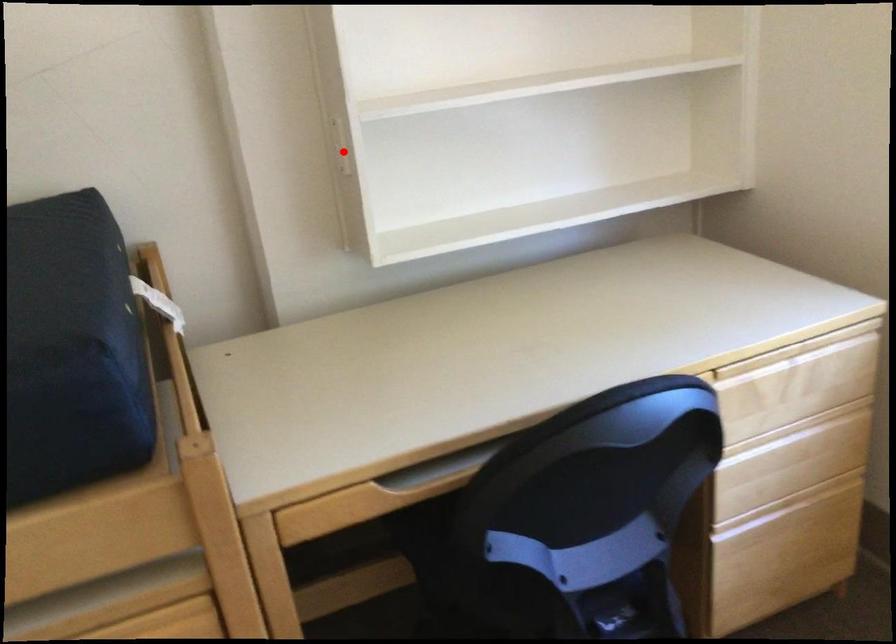
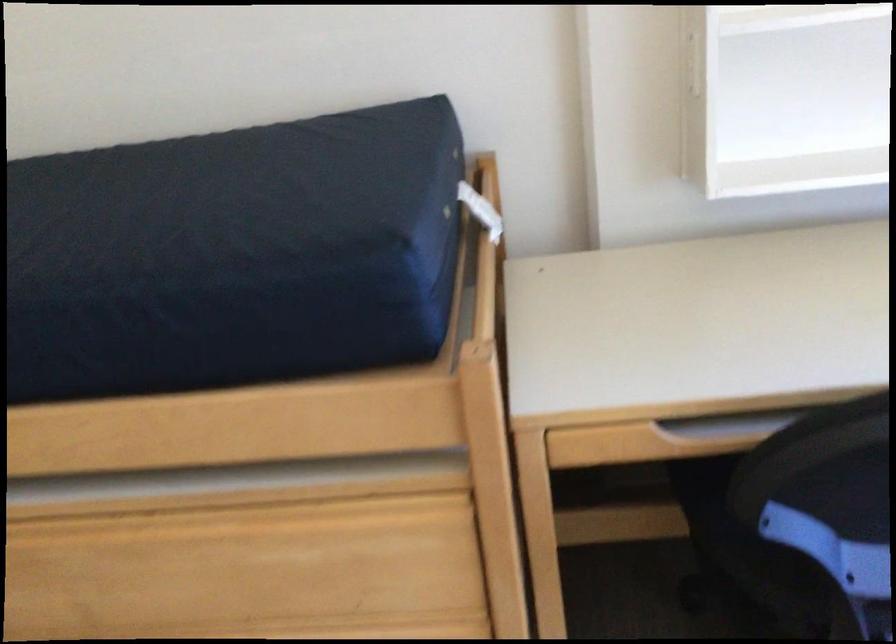
The point at the highlighted location is marked in the first image. Where is the corresponding point in the second image?

(693, 64)